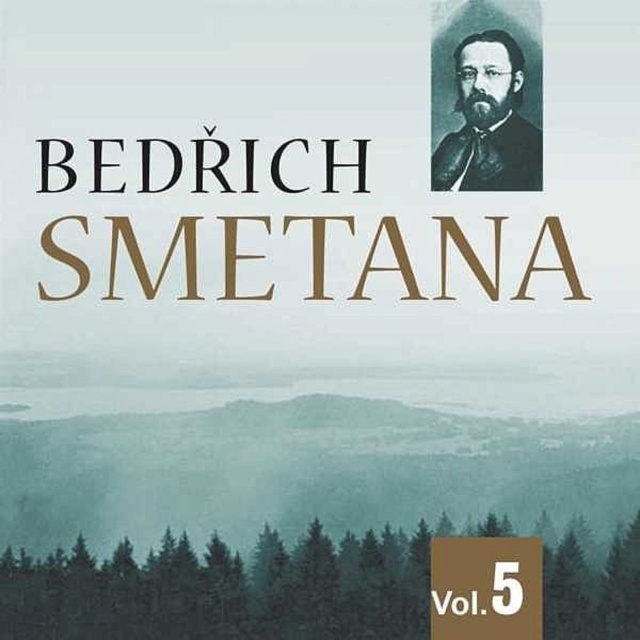
You are designing a poster and want to ensure the gold metallic text at center and the black velvet portrait at upper right are arranged correctly according to the original image. Based on the scene description, which object is closer to the viewer?

The gold metallic text at center is closer to the viewer because it is in front of the black velvet portrait at upper right.

You are designing a layout for a music album cover and need to ensure proper spacing between elements. Given the black serif text at upper center and the black velvet portrait at upper right, which element occupies more horizontal space?

The black serif text at upper center occupies more horizontal space than the black velvet portrait at upper right because its width surpasses the portrait.